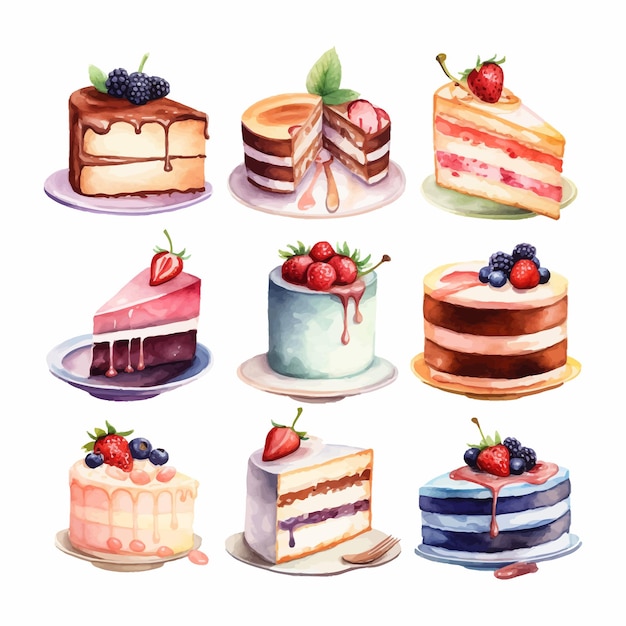
Identify the location of plate. (104, 206), (270, 203), (461, 205), (337, 387), (64, 369), (429, 384), (464, 562), (329, 568), (67, 553).